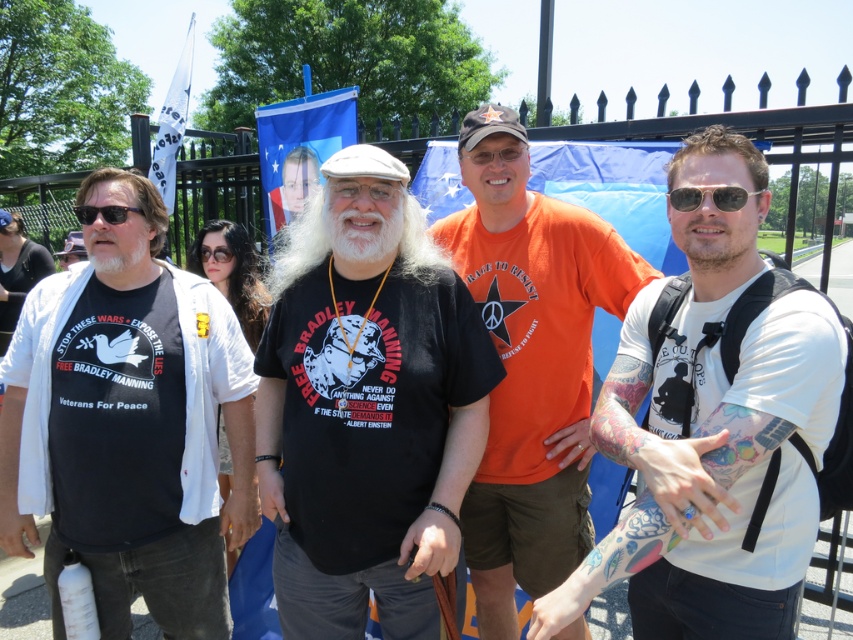
You are a photographer standing in front of the protesters. You notice two pairs of sunglasses among the protesters. The shiny black sunglasses at right and the black plastic sunglasses at left. Which pair is farther from you?

The shiny black sunglasses at right and black plastic sunglasses at left are 5.84 feet apart. Since the shiny black sunglasses are on the right and the black plastic ones are on the left, their distance from you depends on their positions. However, without knowing your exact location, it is impossible to determine which is farther. Please clarify your position relative to the protesters.